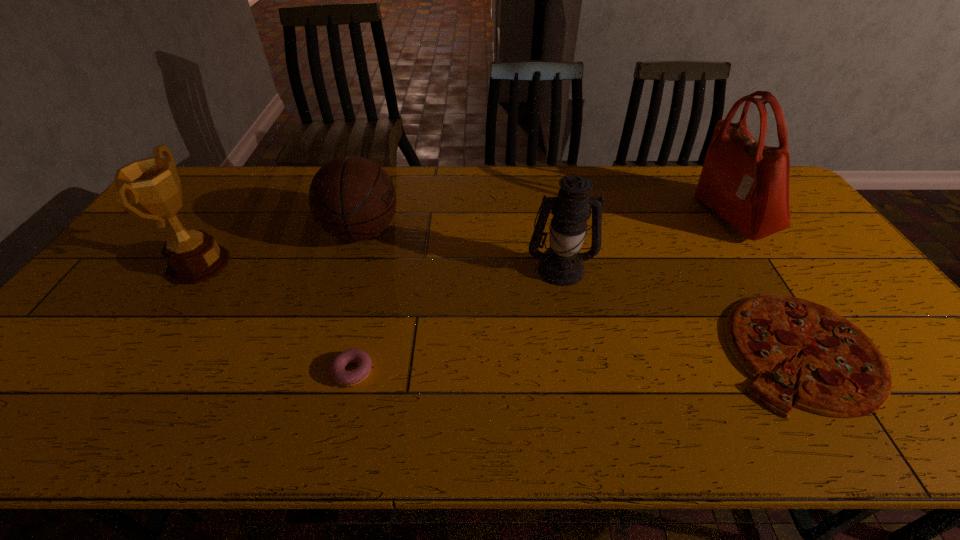
At what (x,y) coordinates should I click in order to perform the action: click on free region that satisfies the following two spatial constraints: 1. on the front-facing side of the leftmost object; 2. on the back side of the pizza. Please return your answer as a coordinate pair (x, y). This screenshot has height=540, width=960. Looking at the image, I should click on (143, 350).

At what (x,y) coordinates should I click in order to perform the action: click on vacant space that satisfies the following two spatial constraints: 1. on the side with brand label of the oil lamp; 2. on the right side of the basketball. Please return your answer as a coordinate pair (x, y). Looking at the image, I should click on (350, 268).